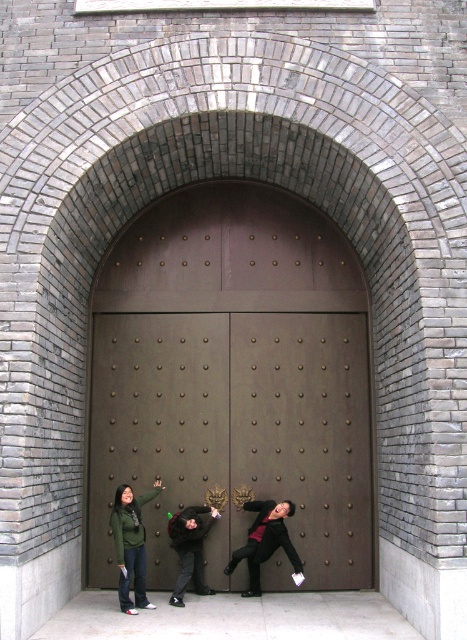
From the picture: Is black leather jacket at lower center to the right of dark gray fabric jacket at lower center from the viewer's perspective?

Indeed, black leather jacket at lower center is positioned on the right side of dark gray fabric jacket at lower center.

Between point (288, 513) and point (197, 524), which one is positioned in front?

Point (197, 524)

Between point (257, 556) and point (205, 522), which one is positioned in front?

Positioned in front is point (257, 556).

The height and width of the screenshot is (640, 467). I want to click on black leather jacket at lower center, so click(x=264, y=541).

Can you confirm if brown polished wood door at center is positioned above black leather jacket at lower center?

Yes.

Which is below, brown polished wood door at center or black leather jacket at lower center?

black leather jacket at lower center is lower down.

Between point (358, 272) and point (283, 529), which one is positioned in front?

Positioned in front is point (283, 529).

Locate an element on the screen. This screenshot has height=640, width=467. brown polished wood door at center is located at coordinates (233, 380).

Does green matte jacket at lower left have a lesser width compared to dark gray fabric jacket at lower center?

Yes.

Does green matte jacket at lower left lie behind dark gray fabric jacket at lower center?

No, green matte jacket at lower left is closer to the viewer.

Image resolution: width=467 pixels, height=640 pixels. Identify the location of green matte jacket at lower left. (131, 545).